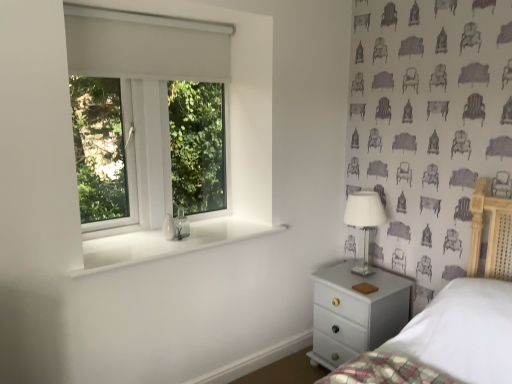
At what (x,y) coordinates should I click in order to perform the action: click on free space above white glossy window sill at lower left (from a real-world perspective). Please return your answer as a coordinate pair (x, y). The width and height of the screenshot is (512, 384). Looking at the image, I should click on (170, 235).